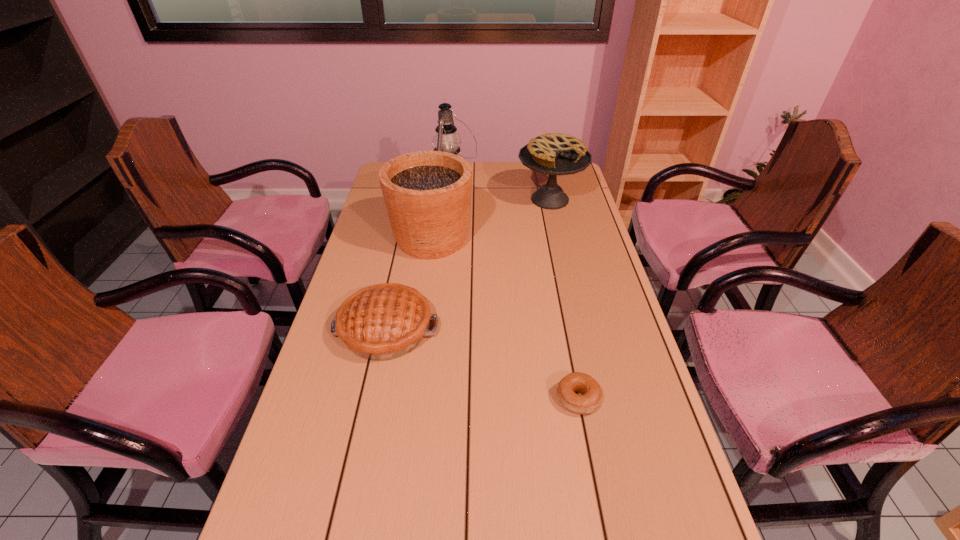
Find the location of a particular element. Image resolution: width=960 pixels, height=540 pixels. vacant space located on the cut side of the farther pie is located at coordinates (557, 228).

The width and height of the screenshot is (960, 540). Find the location of `vacant space located on the front of the nearer pie`. vacant space located on the front of the nearer pie is located at coordinates (349, 500).

Where is `vacant space located on the left of the bagel`? vacant space located on the left of the bagel is located at coordinates (388, 399).

I want to click on oil lamp that is at the far edge, so click(x=446, y=140).

The height and width of the screenshot is (540, 960). What are the coordinates of `pie at the far edge` in the screenshot? It's located at (554, 154).

Locate an element on the screen. Image resolution: width=960 pixels, height=540 pixels. flowerpot at the left edge is located at coordinates (427, 194).

Locate an element on the screen. The image size is (960, 540). pie positioned at the left edge is located at coordinates (382, 322).

This screenshot has height=540, width=960. I want to click on pie situated at the right edge, so click(x=554, y=154).

In order to click on bagel located in the right edge section of the desktop in this screenshot , I will do `click(589, 400)`.

Where is `object present at the far right corner`? The image size is (960, 540). object present at the far right corner is located at coordinates (554, 154).